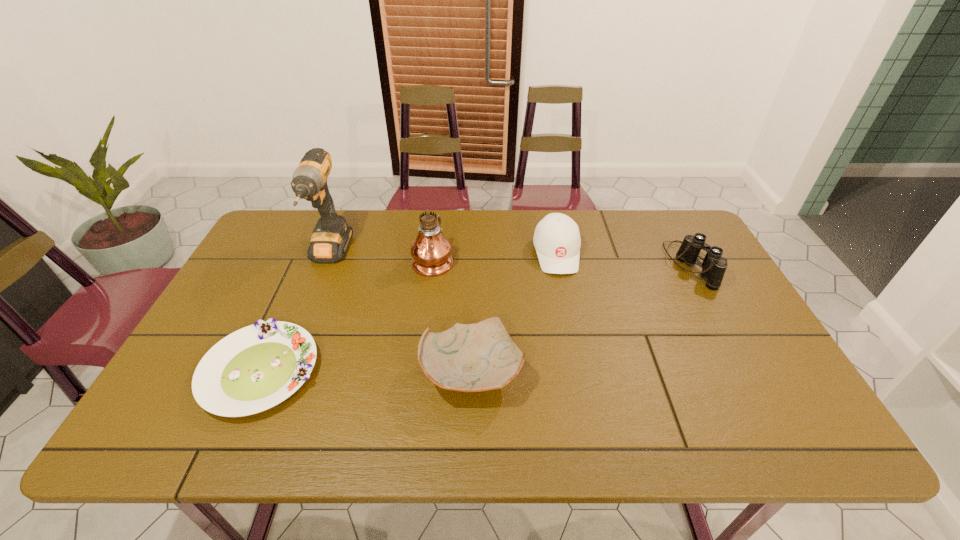
You are a GUI agent. You are given a task and a screenshot of the screen. Output one action in this format:
    pyautogui.click(x=<x>, y=<y>)
    Task: Click on the oil lamp
    
    Given the screenshot: What is the action you would take?
    click(x=431, y=251)

Locate an element on the screen. The height and width of the screenshot is (540, 960). drill is located at coordinates (330, 239).

Where is `baseball cap`? The height and width of the screenshot is (540, 960). baseball cap is located at coordinates (557, 241).

At what (x,y) coordinates should I click in order to perform the action: click on the rightmost object. Please return your answer as a coordinate pair (x, y). This screenshot has height=540, width=960. Looking at the image, I should click on (714, 266).

Identify the location of pottery. Image resolution: width=960 pixels, height=540 pixels. [482, 356].

The width and height of the screenshot is (960, 540). What are the coordinates of `the shortest object` in the screenshot? It's located at (255, 368).

Image resolution: width=960 pixels, height=540 pixels. I want to click on free space located on the front of the oil lamp, so click(x=419, y=372).

What are the coordinates of `vacant space located with the drill bit of the drill facing forward` in the screenshot? It's located at (273, 397).

Image resolution: width=960 pixels, height=540 pixels. In order to click on vacant space located on the front-facing side of the baseball cap in this screenshot , I will do `click(585, 393)`.

Where is `free space located 0.340m on the left of the rightmost object`? Image resolution: width=960 pixels, height=540 pixels. free space located 0.340m on the left of the rightmost object is located at coordinates (557, 266).